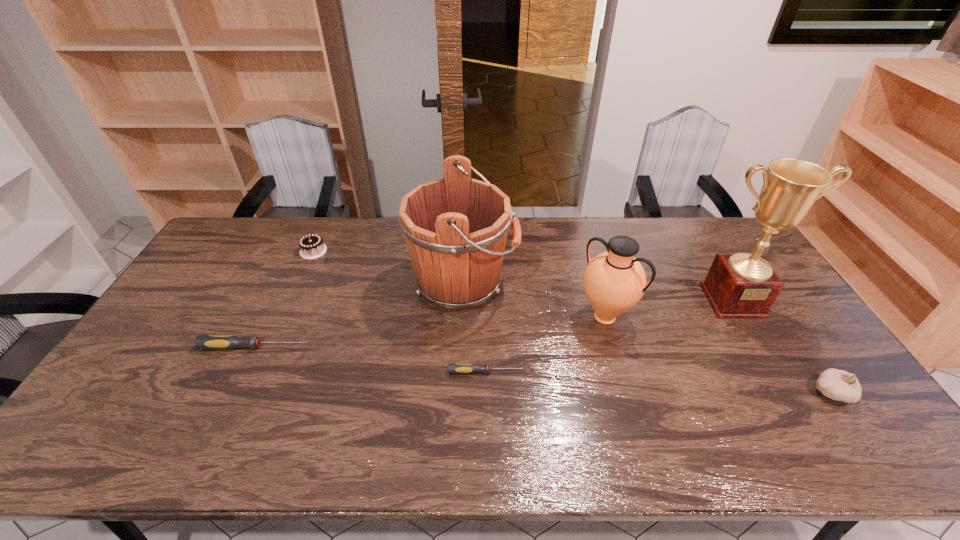
Locate an element on the screen. Image resolution: width=960 pixels, height=540 pixels. vacant region between the fifth object from left to right and the farther screwdriver is located at coordinates (430, 332).

Locate an element on the screen. free space between the trophy cup and the third nearest object is located at coordinates (494, 324).

The width and height of the screenshot is (960, 540). What are the coordinates of `vacant point located between the taller screwdriver and the second tallest object` in the screenshot? It's located at (359, 315).

Image resolution: width=960 pixels, height=540 pixels. What are the coordinates of `free space that is in between the third nearest object and the second nearest object` in the screenshot? It's located at (371, 360).

Where is `free space between the nearest object and the right screwdriver`? The image size is (960, 540). free space between the nearest object and the right screwdriver is located at coordinates (660, 382).

This screenshot has height=540, width=960. Find the location of `free area in between the nearer screwdriver and the bucket`. free area in between the nearer screwdriver and the bucket is located at coordinates (475, 328).

Point out which object is positioned as the sixth nearest to the third nearest object. Please provide its 2D coordinates. Your answer should be formatted as a tuple, i.e. [(x, y)], where the tuple contains the x and y coordinates of a point satisfying the conditions above.

[(838, 385)]

Find the location of a particular element. The image size is (960, 540). object that is the closest to the tallest object is located at coordinates (614, 281).

The width and height of the screenshot is (960, 540). In order to click on vacant area in the image that satisfies the following two spatial constraints: 1. on the plaque of the tallest object; 2. insert the second shortest object into a screw head in this screenshot , I will do `click(760, 347)`.

I want to click on vacant point that satisfies the following two spatial constraints: 1. insert the nearer screwdriver into a screw head; 2. on the back side of the fourth tallest object, so click(487, 393).